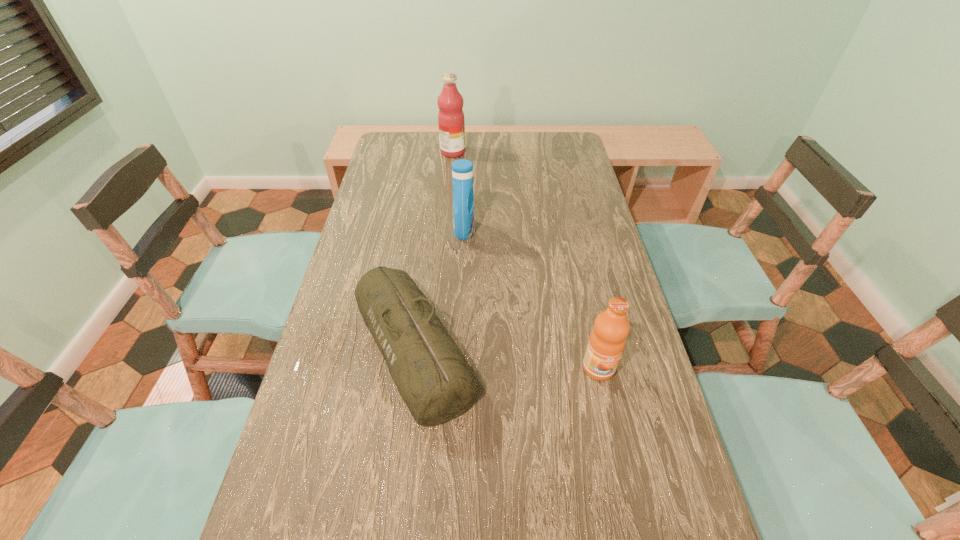
In order to click on object present at the far edge in this screenshot , I will do `click(451, 122)`.

The width and height of the screenshot is (960, 540). I want to click on object at the left edge, so click(436, 383).

You are a GUI agent. You are given a task and a screenshot of the screen. Output one action in this format:
    pyautogui.click(x=<x>, y=<y>)
    Task: Click on the object located at the right edge
    
    Given the screenshot: What is the action you would take?
    pyautogui.click(x=607, y=340)

Identify the location of vacant space at the far edge of the desktop. The height and width of the screenshot is (540, 960). (524, 145).

The width and height of the screenshot is (960, 540). Identify the location of free space at the left edge of the desktop. (373, 245).

You are a GUI agent. You are given a task and a screenshot of the screen. Output one action in this format:
    pyautogui.click(x=<x>, y=<y>)
    Task: Click on the vacant point at the right edge
    
    Given the screenshot: What is the action you would take?
    pyautogui.click(x=644, y=355)

Where is `vacant space at the far right corner of the desktop`? This screenshot has height=540, width=960. vacant space at the far right corner of the desktop is located at coordinates (560, 150).

The image size is (960, 540). I want to click on free space between the duffel bag and the tallest object, so click(433, 251).

You are a GUI agent. You are given a task and a screenshot of the screen. Output one action in this format:
    pyautogui.click(x=<x>, y=<y>)
    Task: Click on the vacant area that lies between the farther fruit juice and the right fruit juice
    This screenshot has width=960, height=540.
    Given the screenshot: What is the action you would take?
    pos(526,260)

The width and height of the screenshot is (960, 540). In order to click on vacant space that's between the shorter fruit juice and the duffel bag in this screenshot , I will do `click(506, 359)`.